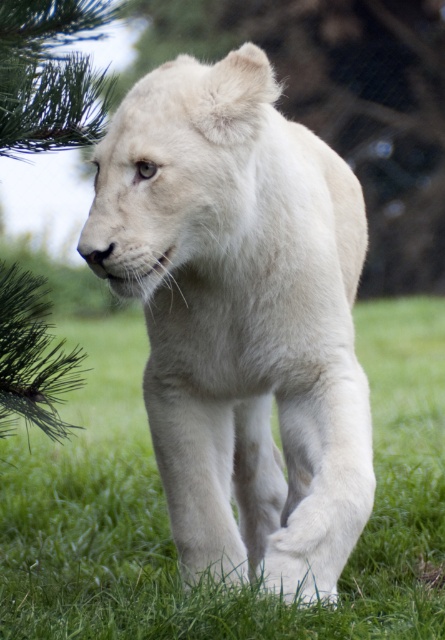
Based on the photo, does white fluffy lion at center have a larger size compared to green soft grass at center?

Yes, white fluffy lion at center is bigger than green soft grass at center.

Between point (258, 134) and point (64, 560), which one is positioned in front?

Point (258, 134)

Does point (258, 173) come in front of point (393, 340)?

Yes, it is in front of point (393, 340).

This screenshot has height=640, width=445. In order to click on white fluffy lion at center in this screenshot , I will do `click(241, 316)`.